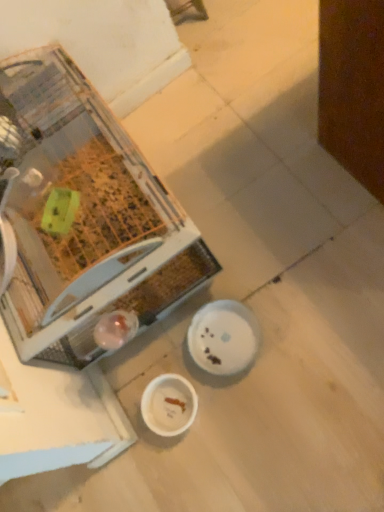
This screenshot has height=512, width=384. In order to click on vacant region to the right of clear plastic cage at left in this screenshot , I will do `click(233, 146)`.